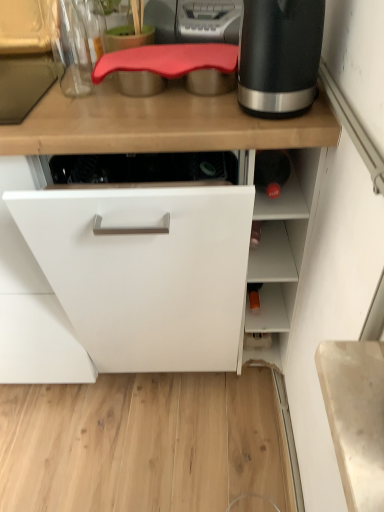
What is the approximate width of black matte electric kettle at upper right?

It is 6.62 inches.

This screenshot has height=512, width=384. What do you see at coordinates (279, 55) in the screenshot? I see `black matte electric kettle at upper right` at bounding box center [279, 55].

Where is `black matte electric kettle at upper right`? The width and height of the screenshot is (384, 512). black matte electric kettle at upper right is located at coordinates (279, 55).

Describe the element at coordinates (194, 20) in the screenshot. I see `rubberized red cutting board at upper center` at that location.

The height and width of the screenshot is (512, 384). I want to click on rubberized red cutting board at upper center, so click(194, 20).

Where is `black matte electric kettle at upper right`? black matte electric kettle at upper right is located at coordinates (279, 55).

Considering the positions of objects black matte electric kettle at upper right and rubberized red cutting board at upper center in the image provided, who is more to the right, black matte electric kettle at upper right or rubberized red cutting board at upper center?

Positioned to the right is black matte electric kettle at upper right.

Is black matte electric kettle at upper right positioned behind rubberized red cutting board at upper center?

That is False.

Is point (304, 76) farther from viewer compared to point (200, 84)?

No, (304, 76) is in front of (200, 84).

From the image's perspective, who appears lower, black matte electric kettle at upper right or rubberized red cutting board at upper center?

black matte electric kettle at upper right, from the image's perspective.

From a real-world perspective, who is located higher, black matte electric kettle at upper right or rubberized red cutting board at upper center?

In real-world perspective, black matte electric kettle at upper right is above.

Does black matte electric kettle at upper right have a greater width compared to rubberized red cutting board at upper center?

No, black matte electric kettle at upper right is not wider than rubberized red cutting board at upper center.

Considering the sizes of objects black matte electric kettle at upper right and rubberized red cutting board at upper center in the image provided, who is taller, black matte electric kettle at upper right or rubberized red cutting board at upper center?

Standing taller between the two is black matte electric kettle at upper right.

Is black matte electric kettle at upper right bigger or smaller than rubberized red cutting board at upper center?

In the image, black matte electric kettle at upper right appears to be smaller than rubberized red cutting board at upper center.

Is black matte electric kettle at upper right situated inside rubberized red cutting board at upper center or outside?

black matte electric kettle at upper right is not enclosed by rubberized red cutting board at upper center.

Would you consider black matte electric kettle at upper right to be distant from rubberized red cutting board at upper center?

No, black matte electric kettle at upper right is in close proximity to rubberized red cutting board at upper center.

Is black matte electric kettle at upper right facing away from rubberized red cutting board at upper center?

black matte electric kettle at upper right does not have its back to rubberized red cutting board at upper center.

Based on the photo, how much distance is there between black matte electric kettle at upper right and rubberized red cutting board at upper center?

They are 8.97 inches apart.

Locate an element on the screen. kitchen appliance above the black matte electric kettle at upper right (from the image's perspective) is located at coordinates (194, 20).

Is rubberized red cutting board at upper center to the left of black matte electric kettle at upper right from the viewer's perspective?

Yes, rubberized red cutting board at upper center is to the left of black matte electric kettle at upper right.

Is rubberized red cutting board at upper center closer to the viewer compared to black matte electric kettle at upper right?

No, the depth of rubberized red cutting board at upper center is greater than that of black matte electric kettle at upper right.

Is point (208, 31) positioned in front of point (319, 30)?

No, (208, 31) is further to viewer.

From the image's perspective, is rubberized red cutting board at upper center located above black matte electric kettle at upper right?

Yes, from the image's perspective, rubberized red cutting board at upper center is over black matte electric kettle at upper right.

From a real-world perspective, between rubberized red cutting board at upper center and black matte electric kettle at upper right, who is vertically lower?

rubberized red cutting board at upper center is physically lower.

Is rubberized red cutting board at upper center thinner than black matte electric kettle at upper right?

No, rubberized red cutting board at upper center is not thinner than black matte electric kettle at upper right.

Does rubberized red cutting board at upper center have a lesser height compared to black matte electric kettle at upper right?

Indeed, rubberized red cutting board at upper center has a lesser height compared to black matte electric kettle at upper right.

Considering the sizes of objects rubberized red cutting board at upper center and black matte electric kettle at upper right in the image provided, who is bigger, rubberized red cutting board at upper center or black matte electric kettle at upper right?

rubberized red cutting board at upper center.

Does rubberized red cutting board at upper center contain black matte electric kettle at upper right?

No, rubberized red cutting board at upper center does not contain black matte electric kettle at upper right.

Would you consider rubberized red cutting board at upper center to be distant from black matte electric kettle at upper right?

No.

Could you tell me if rubberized red cutting board at upper center is turned towards black matte electric kettle at upper right?

Yes, rubberized red cutting board at upper center is facing black matte electric kettle at upper right.

How many degrees apart are the facing directions of rubberized red cutting board at upper center and black matte electric kettle at upper right?

rubberized red cutting board at upper center and black matte electric kettle at upper right are facing 92.6 degrees away from each other.

Locate an element on the screen. The height and width of the screenshot is (512, 384). kitchen appliance on the left side of black matte electric kettle at upper right is located at coordinates (194, 20).

Where is `kitchen appliance above the black matte electric kettle at upper right (from the image's perspective)`? The height and width of the screenshot is (512, 384). kitchen appliance above the black matte electric kettle at upper right (from the image's perspective) is located at coordinates (194, 20).

The image size is (384, 512). Find the location of `kitchen appliance below the black matte electric kettle at upper right (from a real-world perspective)`. kitchen appliance below the black matte electric kettle at upper right (from a real-world perspective) is located at coordinates (194, 20).